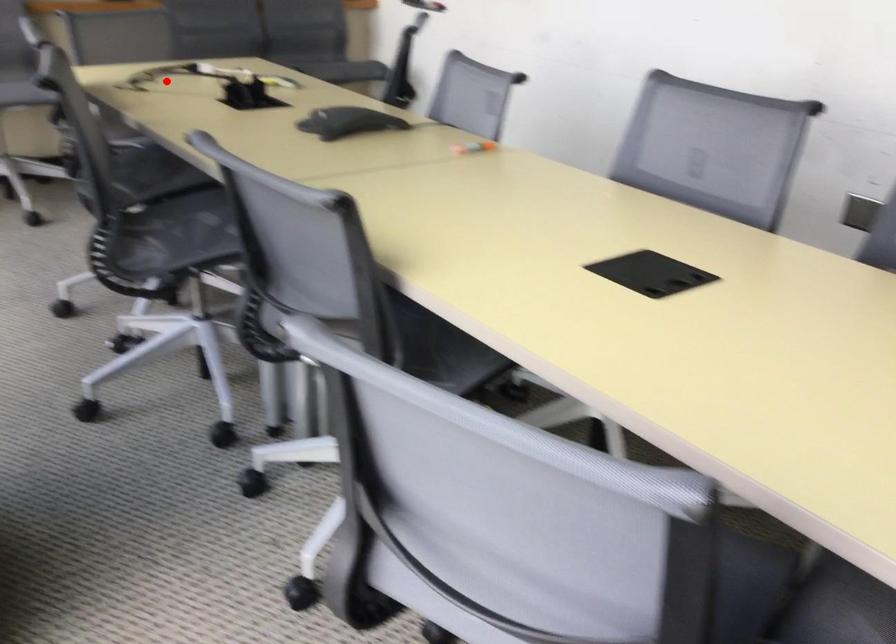
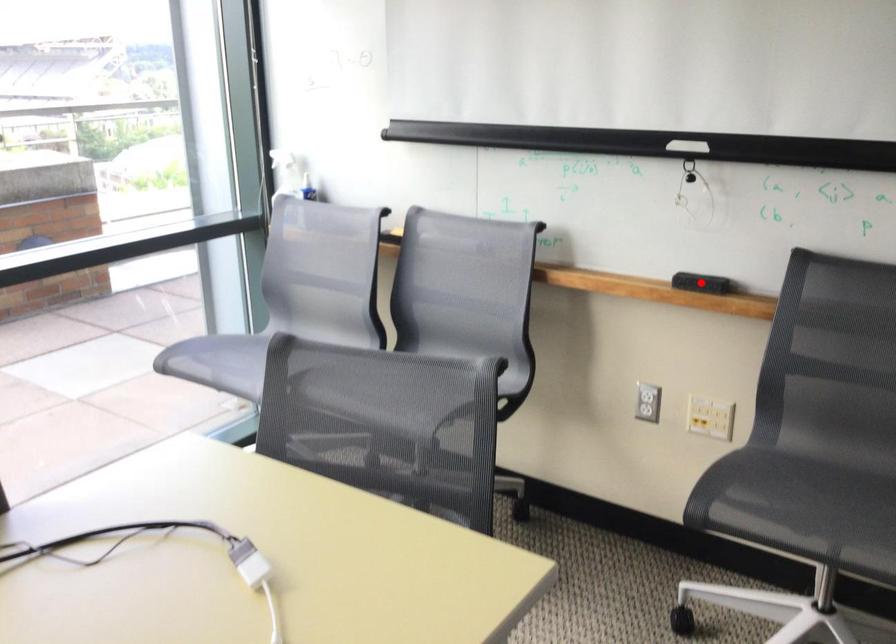
I am providing you with two images of the same scene from different viewpoints. A red point is marked on the first image and another point is marked on the second image. Are the points marked in image1 and image2 representing the same 3D position?

No